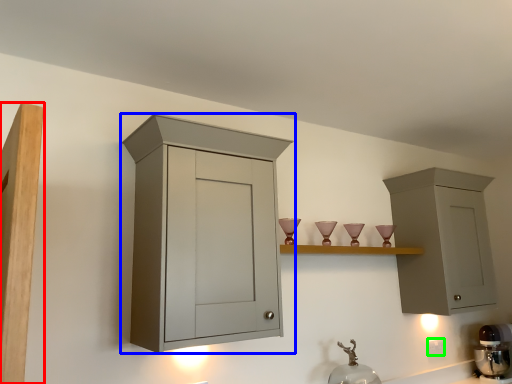
Question: Based on their relative distances, which object is farther from cupboard (highlighted by a red box)? Choose from cabinetry (highlighted by a blue box) and electric outlet (highlighted by a green box).

Choices:
 (A) cabinetry
 (B) electric outlet

Answer: (B)